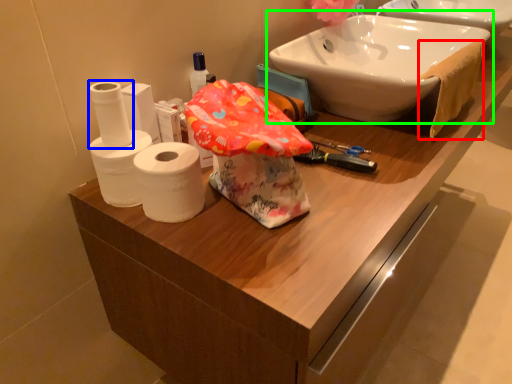
Question: Considering the real-world distances, which object is farthest from bath towel (highlighted by a red box)? toilet paper (highlighted by a blue box) or sink (highlighted by a green box)?

Choices:
 (A) toilet paper
 (B) sink

Answer: (A)